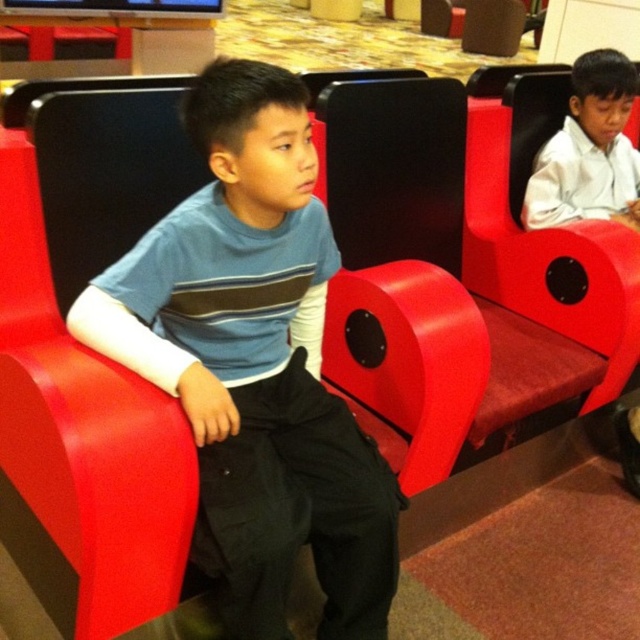
You are a photographer trying to capture a photo of both the matte blue shirt at center and the white glossy shirt at upper right. If you want to frame them side by side in your camera, which direction should you move the camera to include both shirts in the frame?

You should move the camera to the right to include both the matte blue shirt at center and the white glossy shirt at upper right in the frame since the matte blue shirt at center is to the left of the white glossy shirt at upper right.